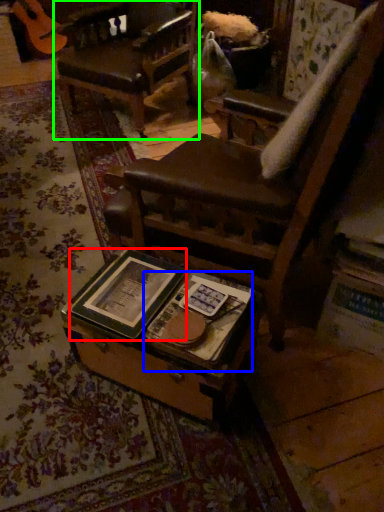
Question: Which object is positioned farthest from paperback book (highlighted by a red box)? Select from paperback book (highlighted by a blue box) and chair (highlighted by a green box).

Choices:
 (A) paperback book
 (B) chair

Answer: (B)